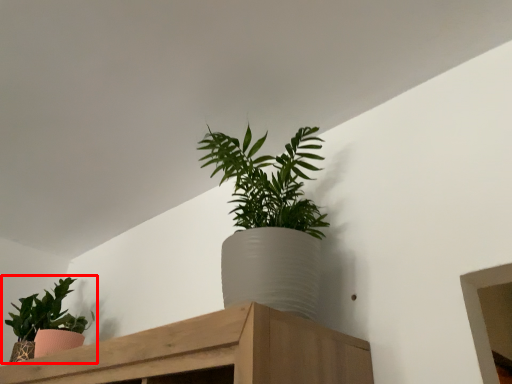
Question: In this image, where is houseplant (annotated by the red box) located relative to houseplant?

Choices:
 (A) left
 (B) right

Answer: (A)